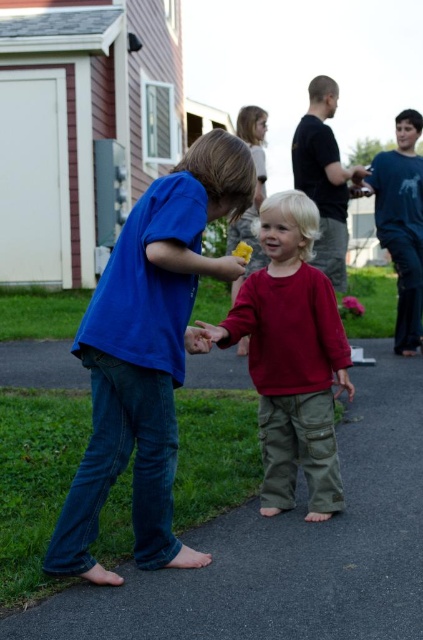
Does point (136, 228) come farther from viewer compared to point (403, 259)?

No, (136, 228) is closer to viewer.

Does blue cotton shirt at center have a greater height compared to blue t-shirt at right?

No, blue cotton shirt at center is not taller than blue t-shirt at right.

Who is more distant from viewer, (84, 472) or (403, 321)?

The point (403, 321) is behind.

Where is `blue cotton shirt at center`? This screenshot has width=423, height=640. blue cotton shirt at center is located at coordinates (148, 355).

Is point (176, 228) positioned after point (274, 243)?

No, it is in front of (274, 243).

Where is `blue cotton shirt at center`? This screenshot has height=640, width=423. blue cotton shirt at center is located at coordinates (148, 355).

Who is more forward, (296,324) or (419,113)?

Point (296,324) is in front.

Does point (279, 237) lie behind point (417, 300)?

No, (279, 237) is closer to viewer.

Find the location of a particular element. The image size is (423, 640). matte red shirt at center is located at coordinates (291, 356).